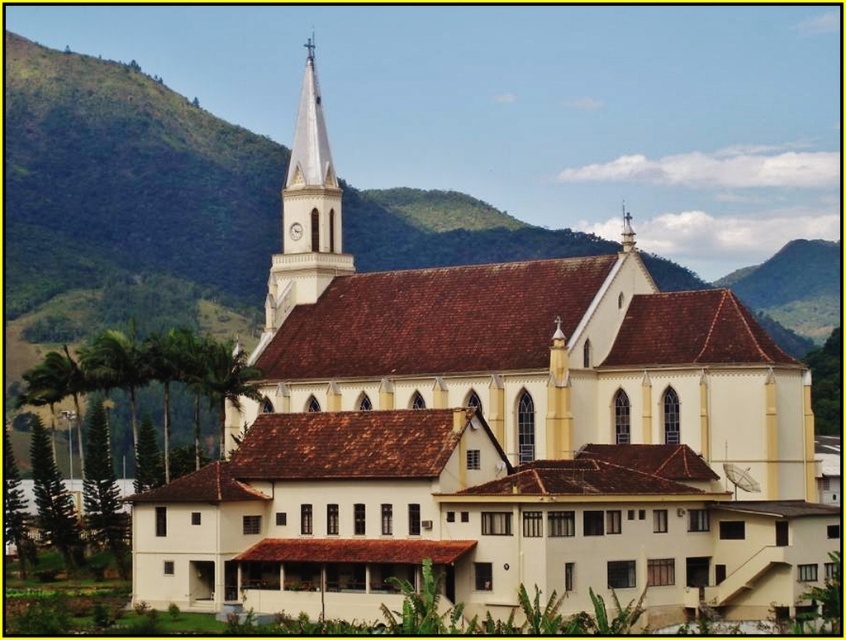
You are an architect examining the church from the front. You notice two structures at the upper center of the church. Which one is taller between the white glossy steeple at upper center and the smooth white spire at upper center?

The white glossy steeple at upper center is taller than the smooth white spire at upper center.

You are standing at the base of the church and want to estimate how far the white glossy steeple at upper center is from you. Based on the image, can you determine the distance?

The distance between the white glossy steeple at upper center and the camera is 370.05 feet, so the steeple is approximately 370.05 feet away from your current position at the base of the church.

Consider the image. You are standing in front of the church and want to locate the white glossy steeple at upper center. According to the coordinates provided, where exactly is it positioned?

The white glossy steeple at upper center is located at point (306, 211).